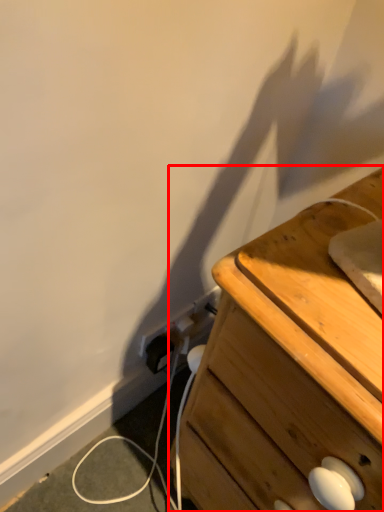
Question: Considering the relative positions of chest of drawers (annotated by the red box) and electric outlet in the image provided, where is chest of drawers (annotated by the red box) located with respect to the staircase?

Choices:
 (A) left
 (B) right

Answer: (B)